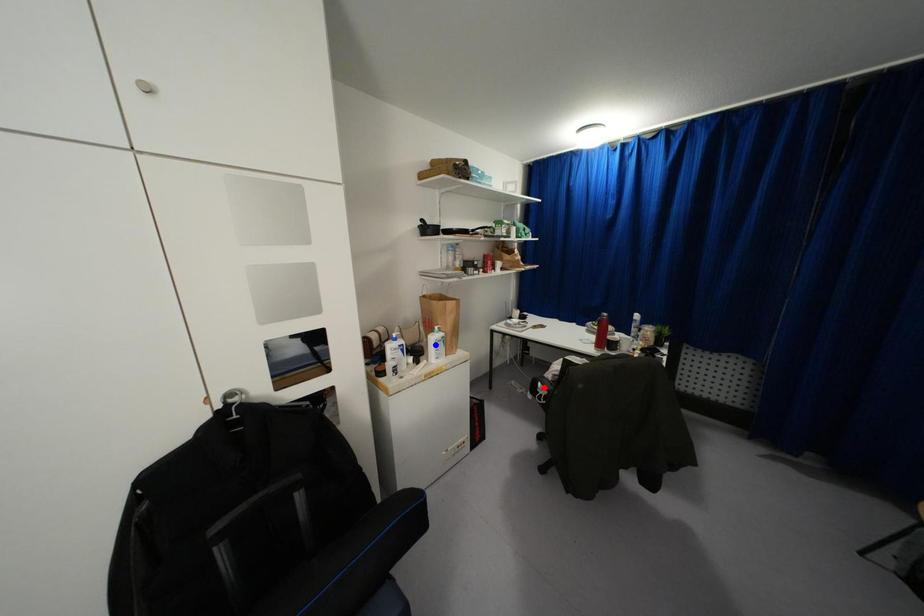
Question: Which of the two points in the image is closer to the camera?

Choices:
 (A) Blue point is closer.
 (B) Red point is closer.

Answer: (A)